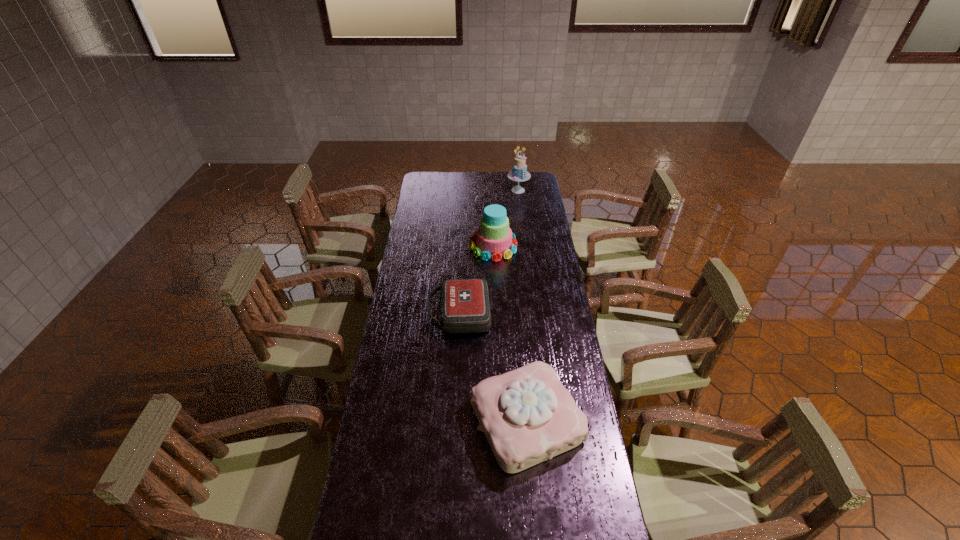
In order to click on the tallest object in this screenshot , I will do `click(519, 173)`.

Identify the location of the farthest object. (519, 173).

Find the location of a particular element. The width and height of the screenshot is (960, 540). the second shortest cake is located at coordinates (493, 238).

The image size is (960, 540). Find the location of `the third shortest object`. the third shortest object is located at coordinates (493, 238).

At what (x,y) coordinates should I click in order to perform the action: click on the nearest cake. Please return your answer as a coordinate pair (x, y). The width and height of the screenshot is (960, 540). Looking at the image, I should click on (527, 415).

This screenshot has width=960, height=540. In order to click on the shortest cake in this screenshot , I will do `click(527, 415)`.

You are a GUI agent. You are given a task and a screenshot of the screen. Output one action in this format:
    pyautogui.click(x=<x>, y=<y>)
    Task: Click on the first-aid kit
    
    Given the screenshot: What is the action you would take?
    pyautogui.click(x=464, y=303)

You are a GUI agent. You are given a task and a screenshot of the screen. Output one action in this format:
    pyautogui.click(x=<x>, y=<y>)
    Task: Click on the shortest object
    This screenshot has width=960, height=540.
    Given the screenshot: What is the action you would take?
    pyautogui.click(x=464, y=303)

Locate an element on the screen. free space located with a ladder on the side of the farthest cake is located at coordinates (523, 235).

Find the location of a particular element. Image resolution: width=960 pixels, height=540 pixels. blank area located 0.280m on the front of the third shortest object is located at coordinates 495,305.